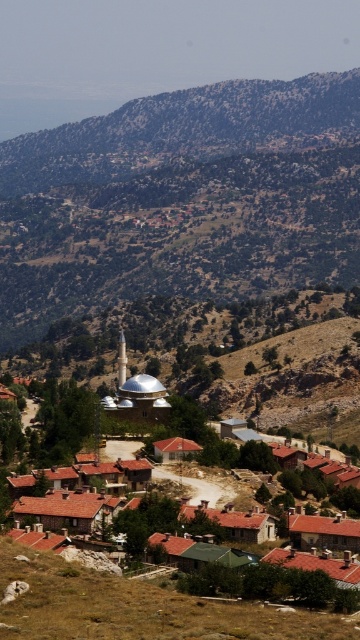
You are a hiker planning to reach the top of the brown rocky mountain at upper center. According to the map, you are currently at the point marked as point (186, 131). Is your current position the base of the mountain?

The brown rocky mountain at upper center is located at point (186, 131), so yes, your current position is the base of the mountain.